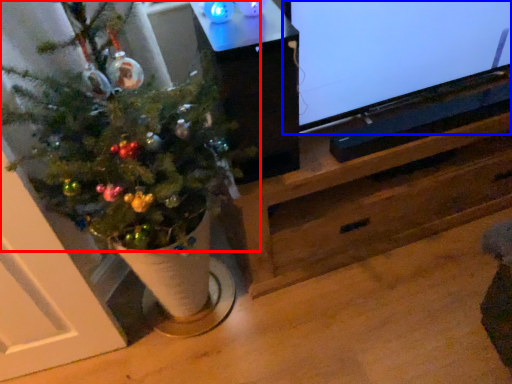
Question: Among these objects, which one is nearest to the camera, christmas tree (highlighted by a red box) or television (highlighted by a blue box)?

Choices:
 (A) christmas tree
 (B) television

Answer: (A)